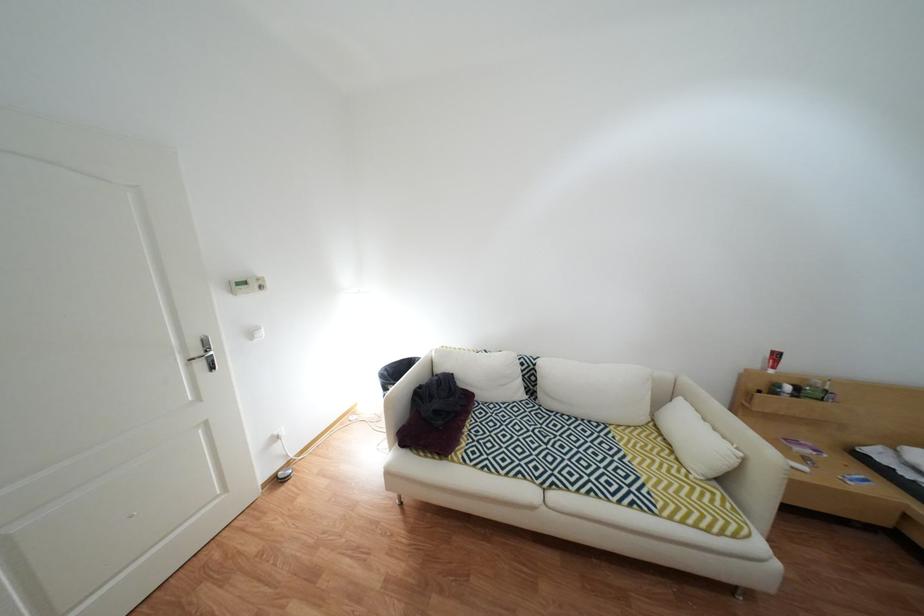
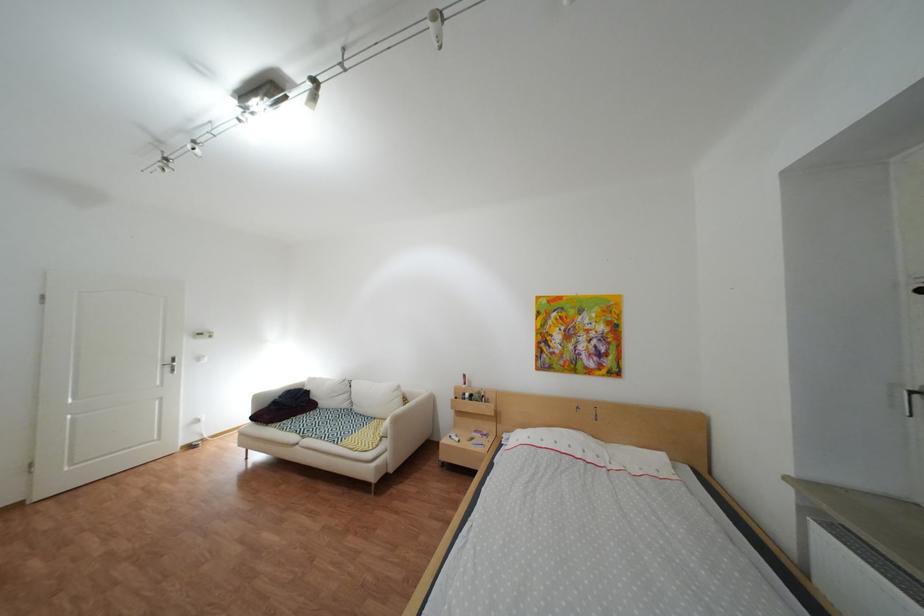
Where in the second image is the point corresponding to (x=476, y=454) from the first image?

(294, 424)